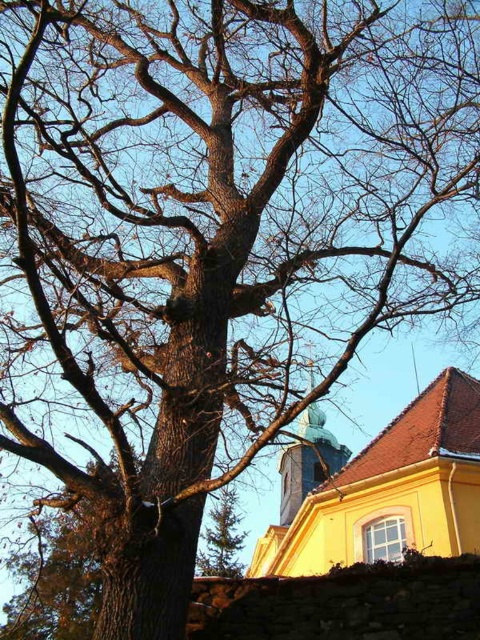
Is point (376, 529) positioned behind point (321, 465)?

No, (376, 529) is closer to viewer.

Identify the location of yellow matte church at upper center. Image resolution: width=480 pixels, height=640 pixels. (384, 490).

Who is higher up, yellow matte church at upper center or green textured pine tree at center?

yellow matte church at upper center is higher up.

From the picture: Who is positioned more to the left, yellow matte church at upper center or green textured pine tree at center?

Positioned to the left is green textured pine tree at center.

Between point (428, 432) and point (238, 518), which one is positioned behind?

Positioned behind is point (238, 518).

The width and height of the screenshot is (480, 640). In order to click on yellow matte church at upper center in this screenshot , I will do `click(384, 490)`.

Can you confirm if light brown stone tower at center is positioned to the right of green textured pine tree at center?

Indeed, light brown stone tower at center is positioned on the right side of green textured pine tree at center.

Is light brown stone tower at center shorter than green textured pine tree at center?

No, light brown stone tower at center is not shorter than green textured pine tree at center.

The image size is (480, 640). I want to click on light brown stone tower at center, so click(308, 461).